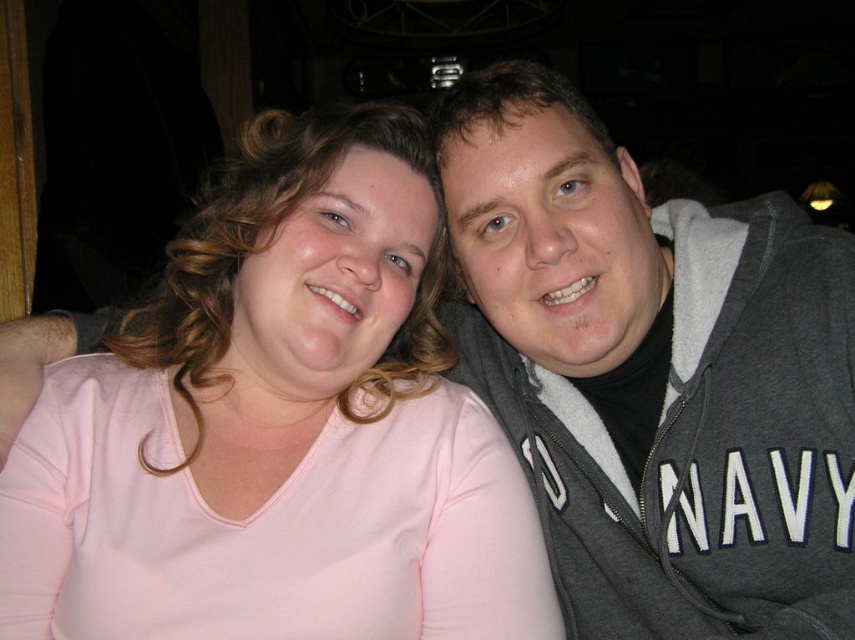
You are a photographer trying to capture a closeup of the pink fabric shirt at center. You are currently positioned at the camera location. Can you estimate whether the shirt is within the typical 36 inches focus range of most standard cameras?

The pink fabric shirt at center is 36.64 inches away from the camera, which is slightly beyond the typical 36 inches focus range of most standard cameras. You may need to adjust your position or use a different lens to ensure it is in focus.

You are a photographer at a social event and want to capture a candid shot of the pink fabric shirt at center and the gray fleece hoodie at upper right. Since the camera has a limited depth of field, which object should you focus on to ensure both are in focus?

The pink fabric shirt at center is positioned under gray fleece hoodie at upper right, so focusing on the gray fleece hoodie at upper right would ensure both are in focus because it is closer to the camera.